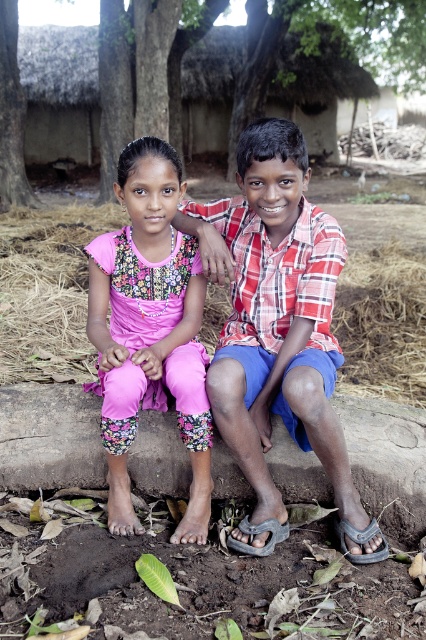
Is red checkered shirt at center positioned behind brown rough tree trunk at upper left?

No, red checkered shirt at center is in front of brown rough tree trunk at upper left.

Is red checkered shirt at center to the right of brown rough tree trunk at upper left from the viewer's perspective?

Correct, you'll find red checkered shirt at center to the right of brown rough tree trunk at upper left.

Measure the distance between red checkered shirt at center and camera.

red checkered shirt at center is 2.20 meters away from camera.

At what (x,y) coordinates should I click in order to perform the action: click on red checkered shirt at center. Please return your answer as a coordinate pair (x, y). Looking at the image, I should click on (278, 330).

Is green leafy tree at upper center closer to camera compared to brown rough tree trunk at upper left?

No, it is not.

Is green leafy tree at upper center below brown rough tree trunk at upper left?

Incorrect, green leafy tree at upper center is not positioned below brown rough tree trunk at upper left.

Who is more forward, (117, 97) or (2, 116)?

Point (2, 116) is more forward.

Where is `green leafy tree at upper center`? green leafy tree at upper center is located at coordinates (141, 72).

What do you see at coordinates (149, 330) in the screenshot? Image resolution: width=426 pixels, height=640 pixels. I see `floral fabric dress at center` at bounding box center [149, 330].

Which is more to the right, floral fabric dress at center or green leafy tree at upper center?

Positioned to the right is floral fabric dress at center.

The height and width of the screenshot is (640, 426). What do you see at coordinates (149, 330) in the screenshot? I see `floral fabric dress at center` at bounding box center [149, 330].

Locate an element on the screen. floral fabric dress at center is located at coordinates (149, 330).